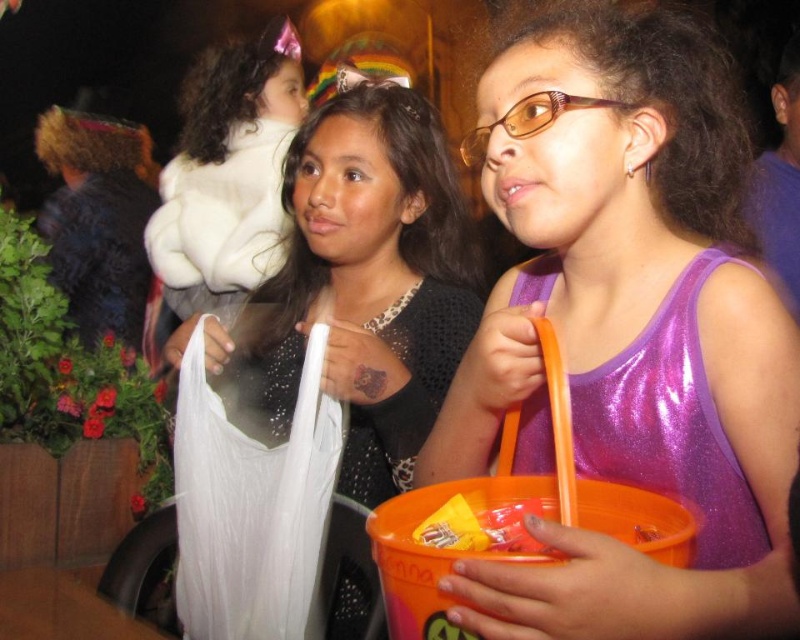
You are a parent trying to organize your childen s Halloween costumes. You see the white matte plastic bag at center and the white fluffy coat at upper left. Which item is closer to you?

The white fluffy coat at upper left is closer to you because it is 19.62 inches away from the white matte plastic bag at center, but since the question is about proximity to you, the coat being at upper left might be positioned closer in the scene. However, the description only states their distance apart, so without additional info on their positions relative to the viewer, the answer can only reference their separation. Wait, perhaps the description implies that the coat is at upper left relative to the

You are a photographer trying to capture the two girls in the scene. The girl on the right is wearing the purple shiny tank top at center. To ensure the tank top is visible in the photo, where should you position the camera relative to the girls?

The purple shiny tank top at center is located at point (628, 330), so positioning the camera to focus on that coordinate will ensure the tank top is visible.

You are a photographer standing at the scene. You want to take a photo of the white matte plastic bag at center so that it appears larger in the photo. What should you do?

To make the white matte plastic bag at center appear larger in the photo, you should move closer to it, as the distance from the camera is currently 3.50 feet. Reducing this distance will magnify its size in the frame.